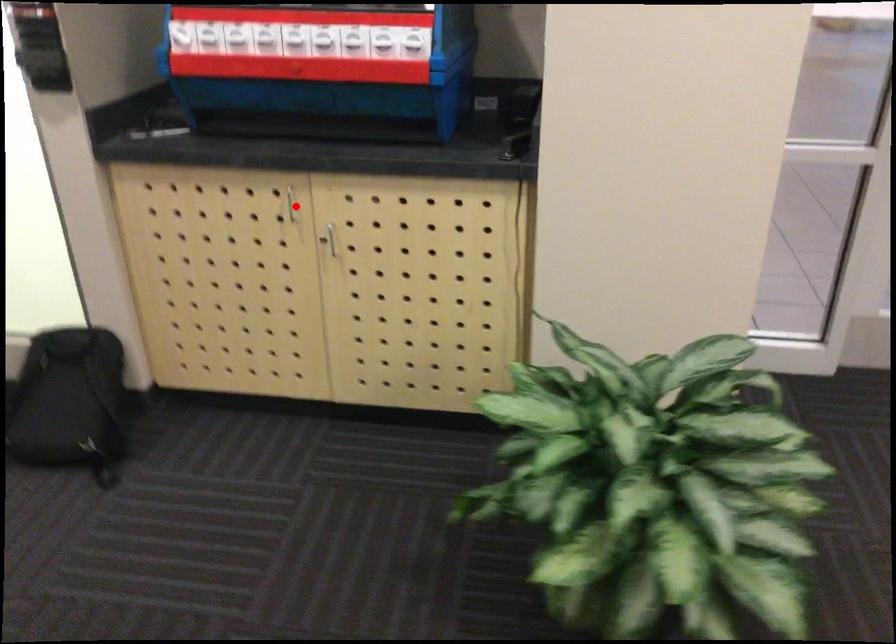
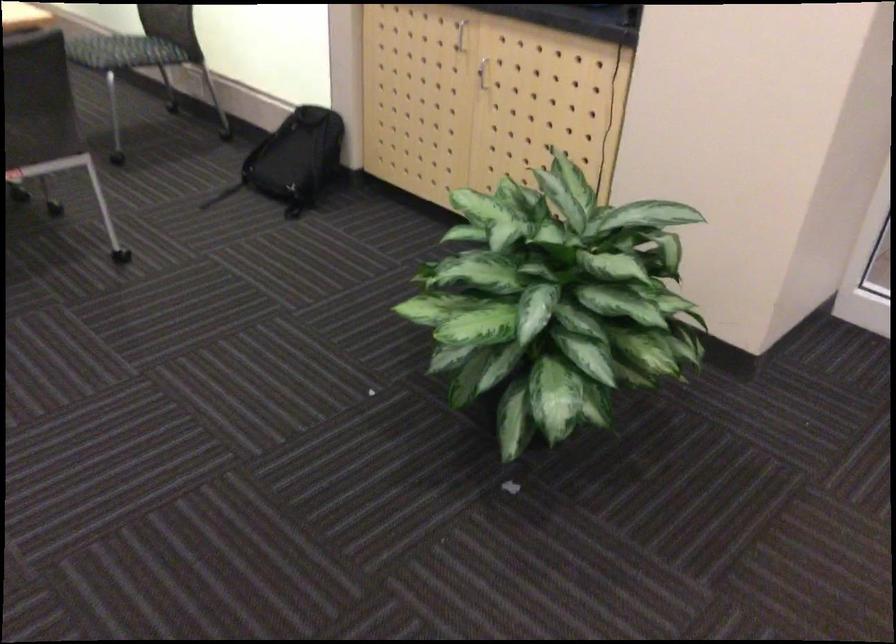
Question: I am providing you with two images of the same scene from different viewpoints. A red point is shown in image1. For the corresponding object point in image2, is it positioned nearer or farther from the camera?

Choices:
 (A) Nearer
 (B) Farther

Answer: (B)